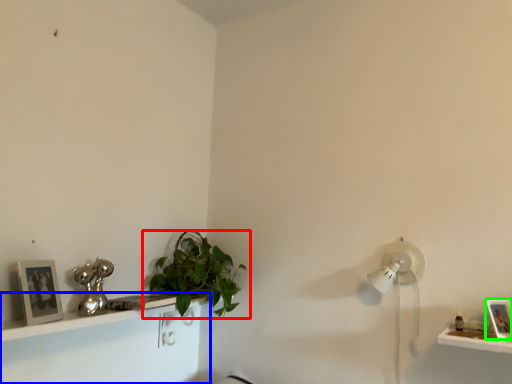
Question: Which is nearer to the houseplant (highlighted by a red box)? shelf (highlighted by a blue box) or picture frame (highlighted by a green box).

Choices:
 (A) shelf
 (B) picture frame

Answer: (A)